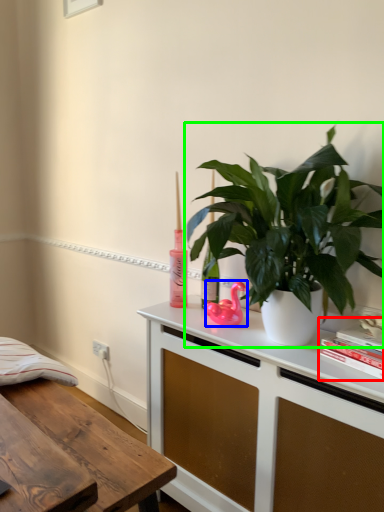
Question: Considering the real-world distances, which object is farthest from book (highlighted by a red box)? appliance (highlighted by a blue box) or houseplant (highlighted by a green box)?

Choices:
 (A) appliance
 (B) houseplant

Answer: (A)